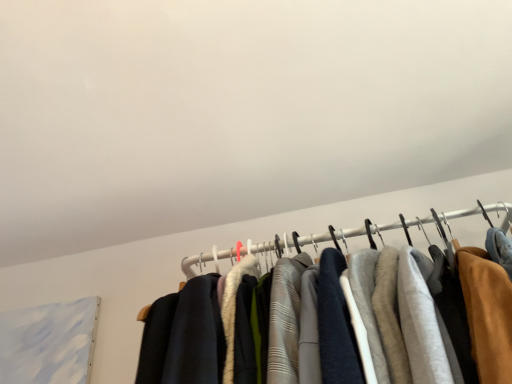
What is the approximate width of dark gray wool pants at center?

10.67 inches.

In order to click on dark gray wool pants at center in this screenshot , I will do `click(487, 312)`.

This screenshot has width=512, height=384. What do you see at coordinates (487, 312) in the screenshot?
I see `dark gray wool pants at center` at bounding box center [487, 312].

Find the location of a particular element. The width and height of the screenshot is (512, 384). dark gray wool pants at center is located at coordinates (487, 312).